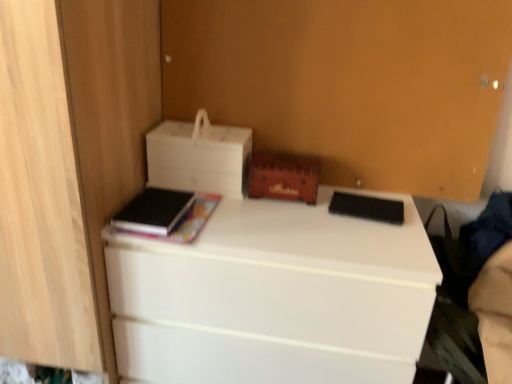
Where is `empty space that is in between black matte book at left, the 2th paperback book positioned from the right, and black matte paperback book at center, the 2th paperback book when ordered from left to right`? empty space that is in between black matte book at left, the 2th paperback book positioned from the right, and black matte paperback book at center, the 2th paperback book when ordered from left to right is located at coordinates (264, 214).